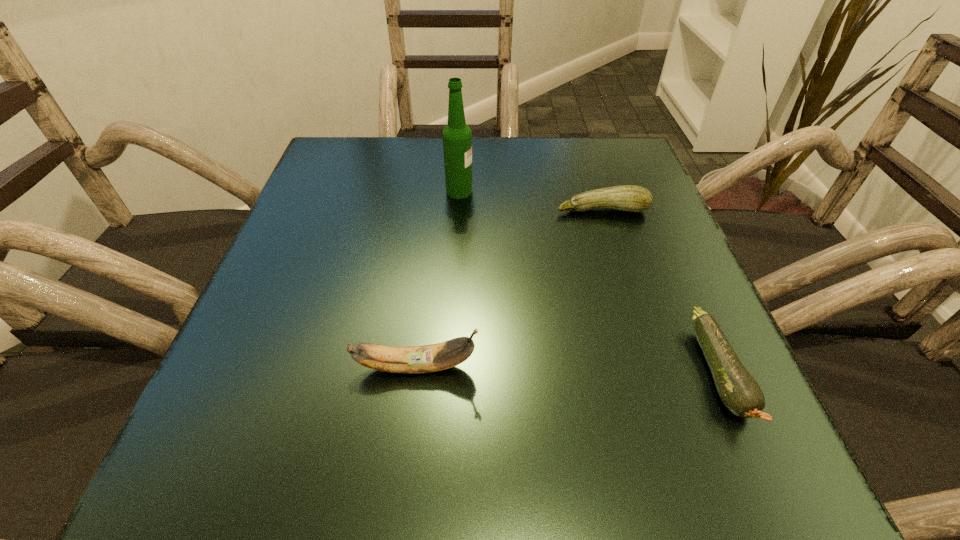
At what (x,y) coordinates should I click in order to perform the action: click on object present at the near edge. Please return your answer as a coordinate pair (x, y). Image resolution: width=960 pixels, height=540 pixels. Looking at the image, I should click on (740, 393).

Identify the location of object situated at the near right corner. (740, 393).

In order to click on vacant area at the far edge in this screenshot , I will do click(495, 137).

In the image, there is a desktop. Where is `vacant space at the near edge`? vacant space at the near edge is located at coordinates (471, 441).

At what (x,y) coordinates should I click in order to perform the action: click on vacant space at the left edge of the desktop. Please return your answer as a coordinate pair (x, y). The height and width of the screenshot is (540, 960). Looking at the image, I should click on (366, 214).

At what (x,y) coordinates should I click in order to perform the action: click on vacant space at the right edge. Please return your answer as a coordinate pair (x, y). This screenshot has height=540, width=960. Looking at the image, I should click on (633, 272).

In the image, there is a desktop. Identify the location of vacant region at the near left corner. (281, 458).

What are the coordinates of `free space at the far right corner of the desktop` in the screenshot? It's located at (568, 145).

Locate an element on the screen. This screenshot has width=960, height=540. vacant area at the near right corner is located at coordinates (763, 442).

Find the location of a particular element. This screenshot has height=540, width=960. free space between the farthest object and the nearer zucchini is located at coordinates (589, 282).